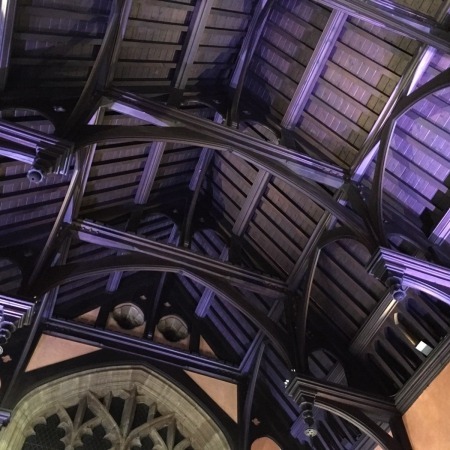
You are a GUI agent. You are given a task and a screenshot of the screen. Output one action in this format:
    pyautogui.click(x=<x>, y=<y>)
    Task: Click on the wall
    Image resolution: width=450 pixels, height=450 pixels.
    Given the screenshot: What is the action you would take?
    point(424,409)